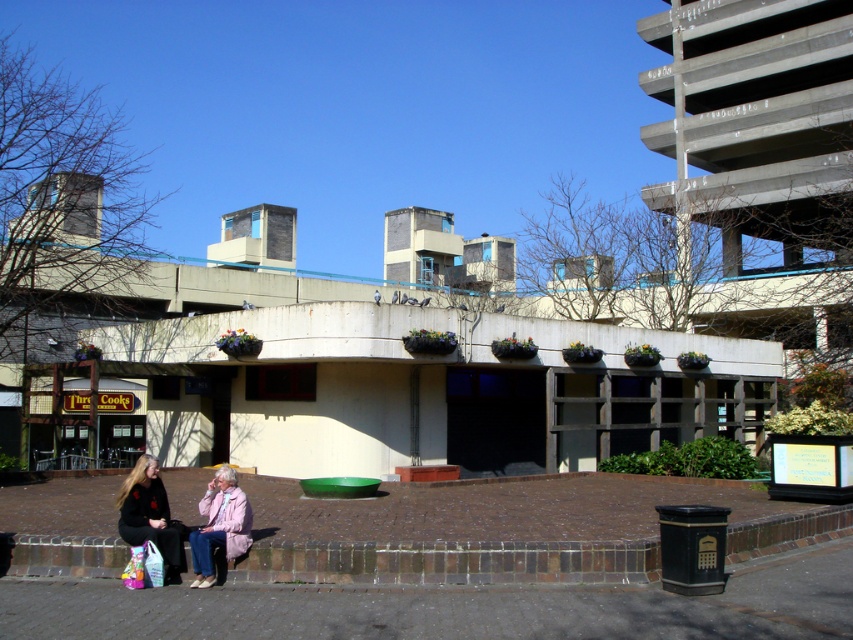
You are standing at the entrance of the building and want to place a new decorative item on the brown brick pavement at lower center. According to the coordinates provided, where exactly should you place it?

The brown brick pavement at lower center should be placed at the coordinates point (x=450, y=608).

You are a delivery person trying to place a large package between the black fabric jacket at lower left and the light pink fabric coat at lower left. Based on their widths, can you estimate if there will be enough space?

The black fabric jacket at lower left might be wider than the light pink fabric coat at lower left, so there may not be enough space for the large package between them.

You are standing on the brown brick pavement at lower center and want to pick up the light pink fabric coat at lower left. Is the coat within your immediate reach without moving your feet?

The brown brick pavement at lower center is below the light pink fabric coat at lower left, meaning the coat is elevated relative to the pavement. Since you are standing on the pavement, the coat is likely placed on a higher surface, so you might need to step onto something or stretch to reach it.